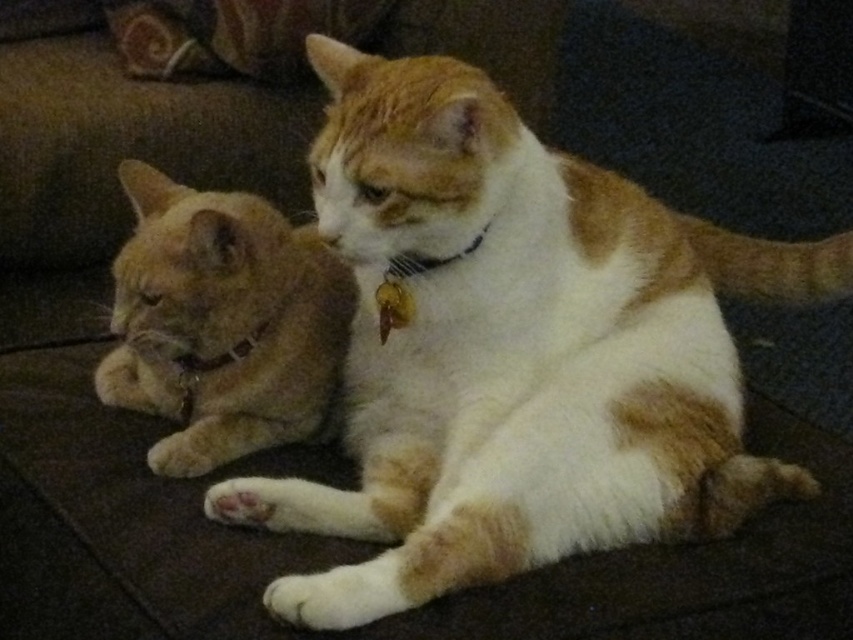
Is white fur cat at center smaller than orange fur cat at left?

No, white fur cat at center is not smaller than orange fur cat at left.

Between point (733, 342) and point (207, 429), which one is positioned behind?

The point (733, 342) is more distant.

Locate an element on the screen. This screenshot has width=853, height=640. white fur cat at center is located at coordinates (515, 349).